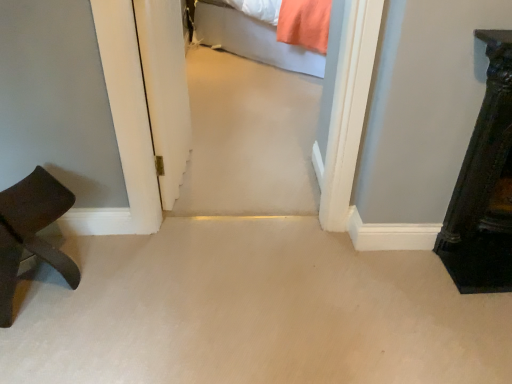
Question: Is there a large distance between dark wood dresser at right, the 2th furniture viewed from the left, and transparent glass door at center?

Choices:
 (A) yes
 (B) no

Answer: (A)

Question: Does dark wood dresser at right, positioned as the first furniture in right-to-left order, have a greater width compared to transparent glass door at center?

Choices:
 (A) yes
 (B) no

Answer: (B)

Question: Is transparent glass door at center inside dark wood dresser at right, positioned as the first furniture in right-to-left order?

Choices:
 (A) no
 (B) yes

Answer: (A)

Question: Considering the relative sizes of dark wood dresser at right, the 2th furniture viewed from the left, and transparent glass door at center in the image provided, is dark wood dresser at right, the 2th furniture viewed from the left, shorter than transparent glass door at center?

Choices:
 (A) yes
 (B) no

Answer: (A)

Question: Is dark wood dresser at right, positioned as the first furniture in right-to-left order, positioned before transparent glass door at center?

Choices:
 (A) no
 (B) yes

Answer: (B)

Question: Is point (158, 16) positioned closer to the camera than point (1, 220)?

Choices:
 (A) closer
 (B) farther

Answer: (B)

Question: In terms of width, does transparent glass door at center look wider or thinner when compared to dark brown wood stool at left, which is counted as the 2th furniture, starting from the right?

Choices:
 (A) thin
 (B) wide

Answer: (A)

Question: In terms of height, does transparent glass door at center look taller or shorter compared to dark brown wood stool at left, which is counted as the 2th furniture, starting from the right?

Choices:
 (A) tall
 (B) short

Answer: (A)

Question: Considering their positions, is transparent glass door at center located in front of or behind dark brown wood stool at left, which is counted as the 2th furniture, starting from the right?

Choices:
 (A) behind
 (B) front

Answer: (A)

Question: Considering the positions of light gray fabric bed at upper center and transparent glass door at center in the image, is light gray fabric bed at upper center wider or thinner than transparent glass door at center?

Choices:
 (A) thin
 (B) wide

Answer: (B)

Question: From their relative heights in the image, would you say light gray fabric bed at upper center is taller or shorter than transparent glass door at center?

Choices:
 (A) tall
 (B) short

Answer: (B)

Question: From the image's perspective, is light gray fabric bed at upper center above or below transparent glass door at center?

Choices:
 (A) above
 (B) below

Answer: (A)

Question: From a real-world perspective, relative to transparent glass door at center, is light gray fabric bed at upper center vertically above or below?

Choices:
 (A) above
 (B) below

Answer: (B)

Question: Is dark brown wood stool at left, which is counted as the 2th furniture, starting from the right, spatially inside dark wood dresser at right, the 2th furniture viewed from the left, or outside of it?

Choices:
 (A) outside
 (B) inside

Answer: (A)

Question: Considering the positions of dark brown wood stool at left, which is counted as the 2th furniture, starting from the right, and dark wood dresser at right, positioned as the first furniture in right-to-left order, in the image, is dark brown wood stool at left, which is counted as the 2th furniture, starting from the right, taller or shorter than dark wood dresser at right, positioned as the first furniture in right-to-left order,?

Choices:
 (A) short
 (B) tall

Answer: (A)